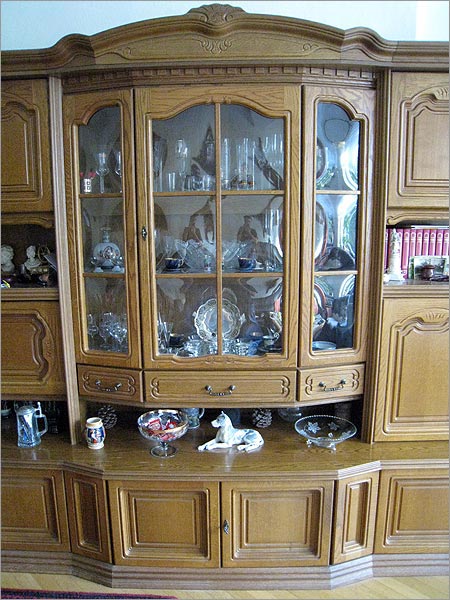
At what (x,y) coordinates should I click in order to perform the action: click on books. Please return your answer as a coordinate pair (x, y). This screenshot has width=450, height=600. Looking at the image, I should click on (423, 237).